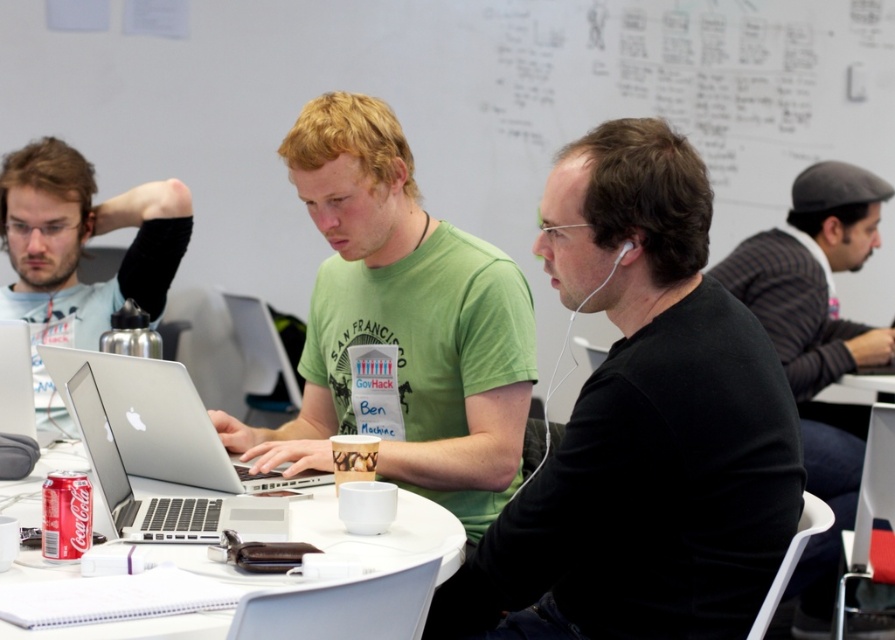
What do you see at coordinates (382, 534) in the screenshot?
I see `white plastic table at center` at bounding box center [382, 534].

From the picture: Is white plastic table at center positioned behind silver metallic laptop at center?

That is False.

Is point (456, 557) positioned before point (156, 372)?

Yes, point (456, 557) is in front of point (156, 372).

Where is `white plastic table at center`? white plastic table at center is located at coordinates (382, 534).

Does matte black laptop at left have a larger size compared to silver metallic laptop at center?

Yes.

Does point (133, 193) come behind point (124, 396)?

Yes, it is.

Describe the element at coordinates (81, 244) in the screenshot. This screenshot has width=895, height=640. I see `matte black laptop at left` at that location.

Image resolution: width=895 pixels, height=640 pixels. I want to click on matte black laptop at left, so click(81, 244).

Who is taller, striped wool sweater at right or matte black laptop at left?

striped wool sweater at right

Can you confirm if striped wool sweater at right is positioned below matte black laptop at left?

Indeed, striped wool sweater at right is positioned under matte black laptop at left.

Find the location of `striped wool sweater at right`. striped wool sweater at right is located at coordinates (816, 344).

Where is `striped wool sweater at right`? Image resolution: width=895 pixels, height=640 pixels. striped wool sweater at right is located at coordinates pos(816,344).